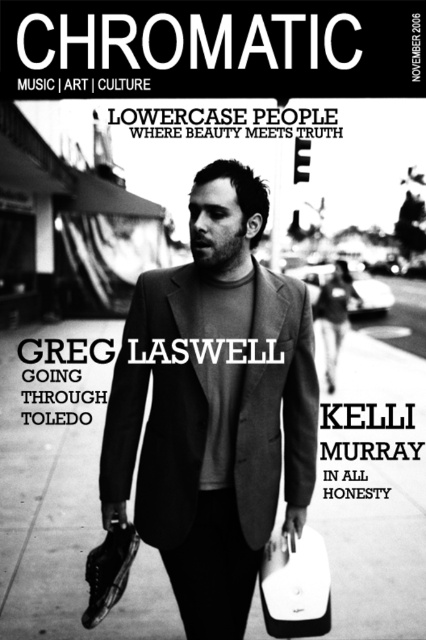
Which is above, matte black suit at center or white matte briefcase at lower center?

Positioned higher is matte black suit at center.

Which is in front, point (233, 307) or point (302, 538)?

Point (233, 307) is in front.

Find the location of `matte black suit at center`. matte black suit at center is located at coordinates (213, 406).